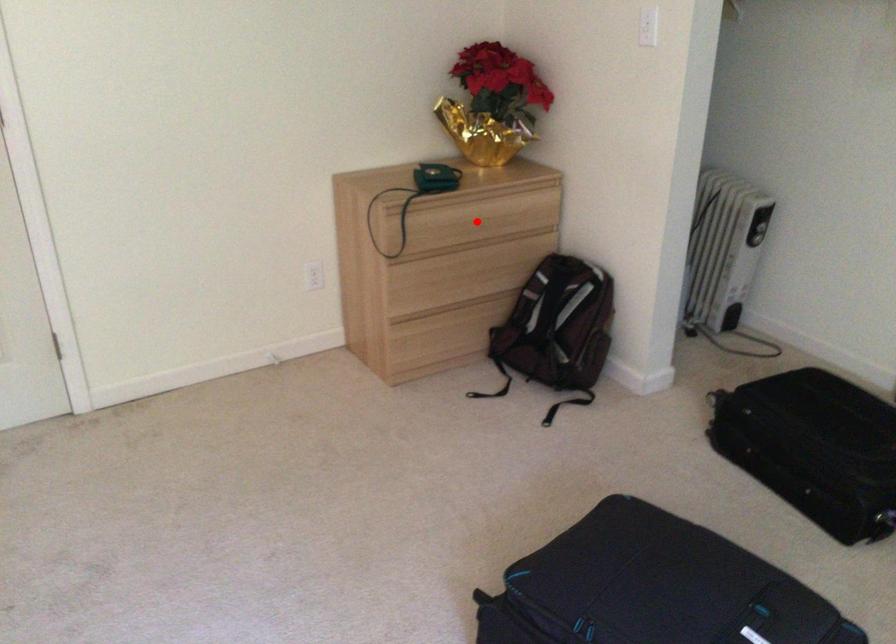
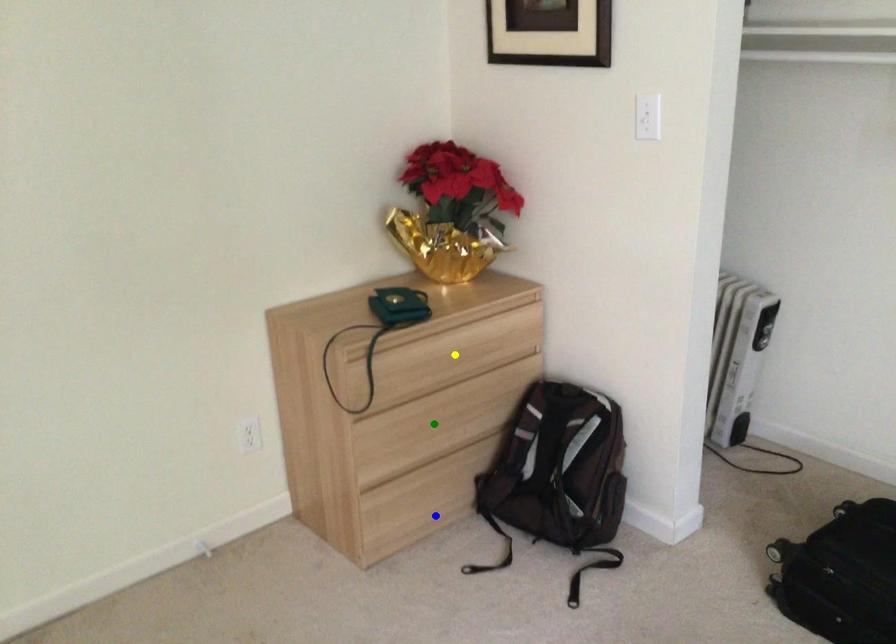
Question: I am providing you with two images of the same scene from different viewpoints. A red point is marked on the first image. You are given multiple points on the second image. In image 2, which mark is for the same physical point as the one in image 1?

Choices:
 (A) yellow point
 (B) green point
 (C) blue point

Answer: (A)